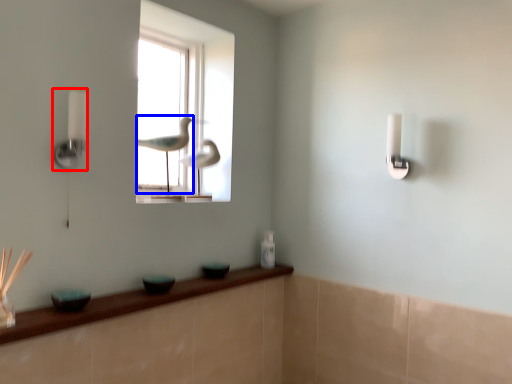
Question: Which of the following is the farthest to the observer, lamp (highlighted by a red box) or bird (highlighted by a blue box)?

Choices:
 (A) lamp
 (B) bird

Answer: (B)